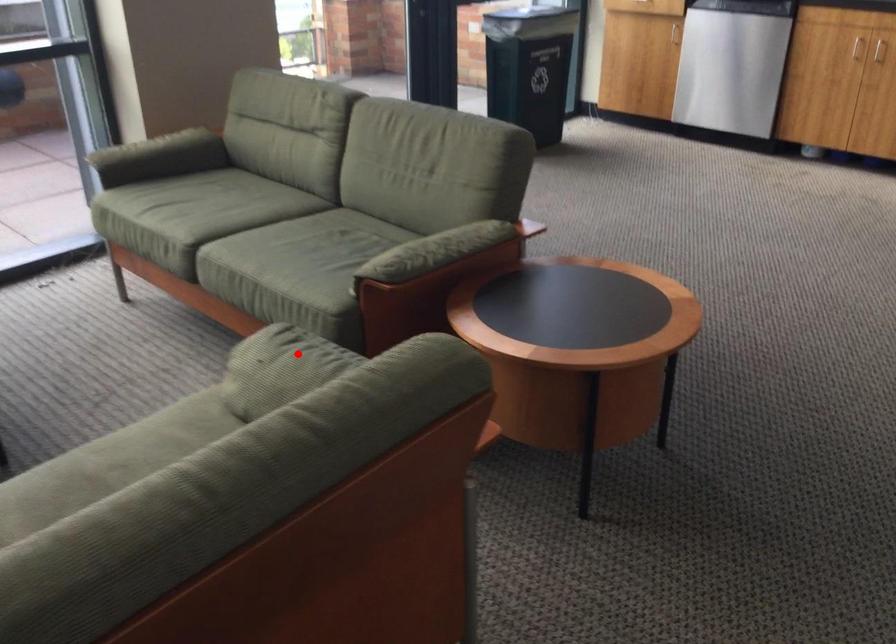
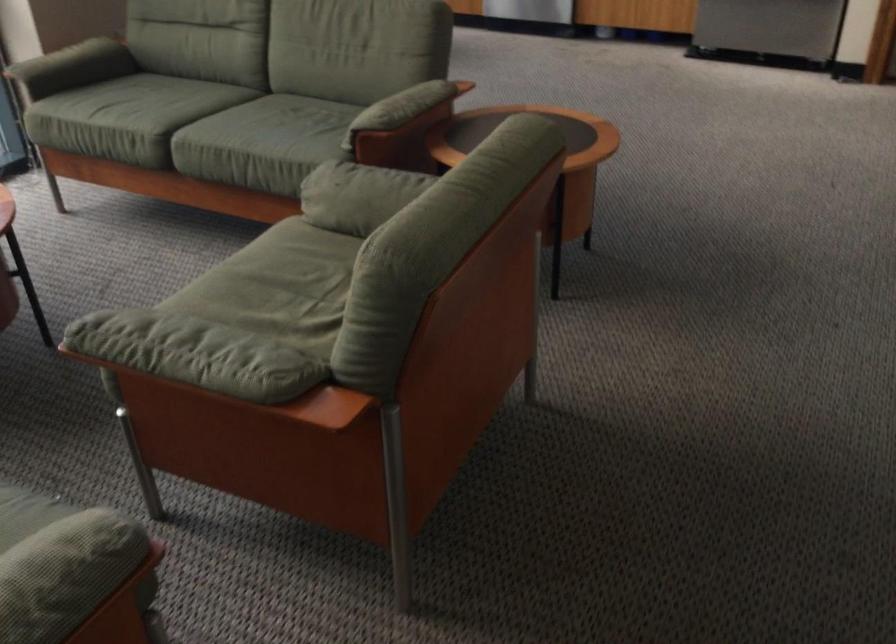
Question: I am providing you with two images of the same scene from different viewpoints. A red point is shown in image1. For the corresponding object point in image2, is it positioned nearer or farther from the camera?

Choices:
 (A) Nearer
 (B) Farther

Answer: (B)